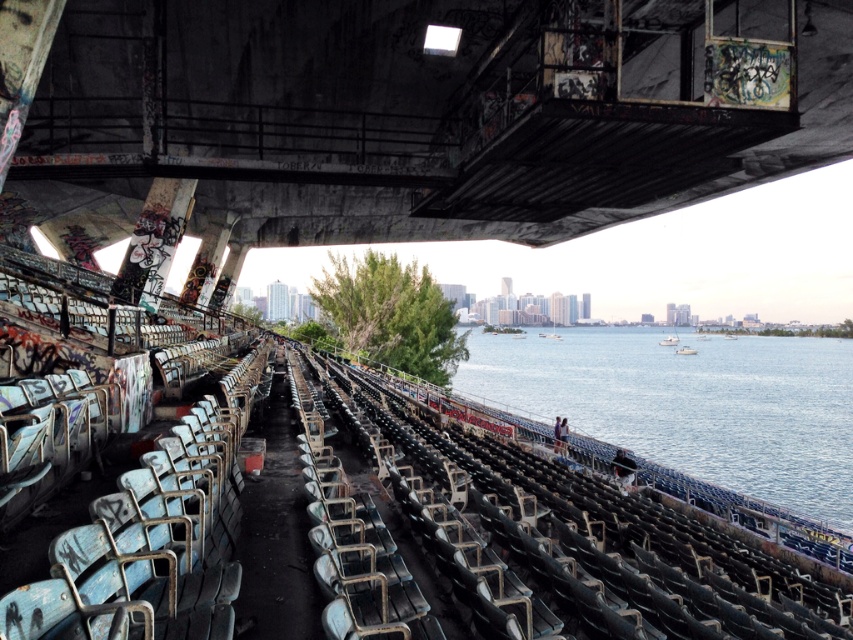
Question: Estimate the real-world distances between objects in this image. Which object is farther from the concrete textured overpass at upper center?

Choices:
 (A) blue water at center
 (B) metallic blue seats at center

Answer: (A)

Question: Can you confirm if metallic blue seats at center is bigger than blue water at center?

Choices:
 (A) no
 (B) yes

Answer: (A)

Question: Which point is closer to the camera?

Choices:
 (A) (262, 241)
 (B) (512, 380)
 (C) (718, 547)

Answer: (C)

Question: Which of the following is the closest to the observer?

Choices:
 (A) concrete textured overpass at upper center
 (B) metallic blue seats at center

Answer: (B)

Question: Is the position of concrete textured overpass at upper center less distant than that of blue water at center?

Choices:
 (A) yes
 (B) no

Answer: (A)

Question: Is concrete textured overpass at upper center smaller than blue water at center?

Choices:
 (A) no
 (B) yes

Answer: (B)